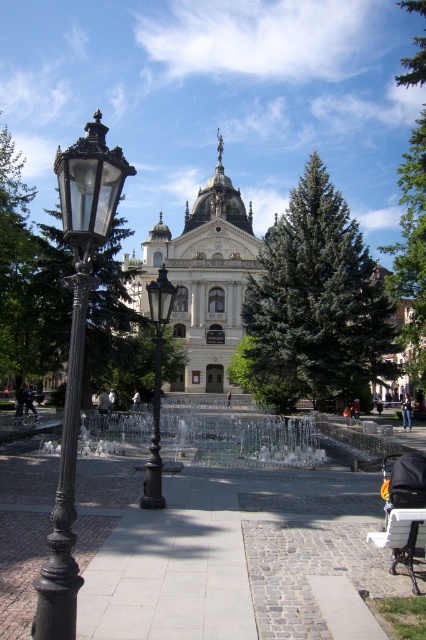
Question: Is polished brass street light at left to the right of white plastic bench at lower right from the viewer's perspective?

Choices:
 (A) yes
 (B) no

Answer: (B)

Question: Which object is the farthest from the matte black street light at left?

Choices:
 (A) cobblestone pavement at center
 (B) light brown wooden bench at center
 (C) white fabric person at center
 (D) white plastic bench at lower right

Answer: (D)

Question: Estimate the real-world distances between objects in this image. Which object is farther from the jeans at center?

Choices:
 (A) cobblestone pavement at center
 (B) matte black street light at left
 (C) clear glass water at center

Answer: (B)

Question: Is green needle-like tree at center positioned in front of matte black street light at left?

Choices:
 (A) yes
 (B) no

Answer: (B)

Question: Which of the following is the farthest from the observer?

Choices:
 (A) light brown wooden bench at center
 (B) clear glass water at center
 (C) jeans at center

Answer: (A)

Question: Is matte black street light at left bigger than white fabric person at center?

Choices:
 (A) no
 (B) yes

Answer: (B)